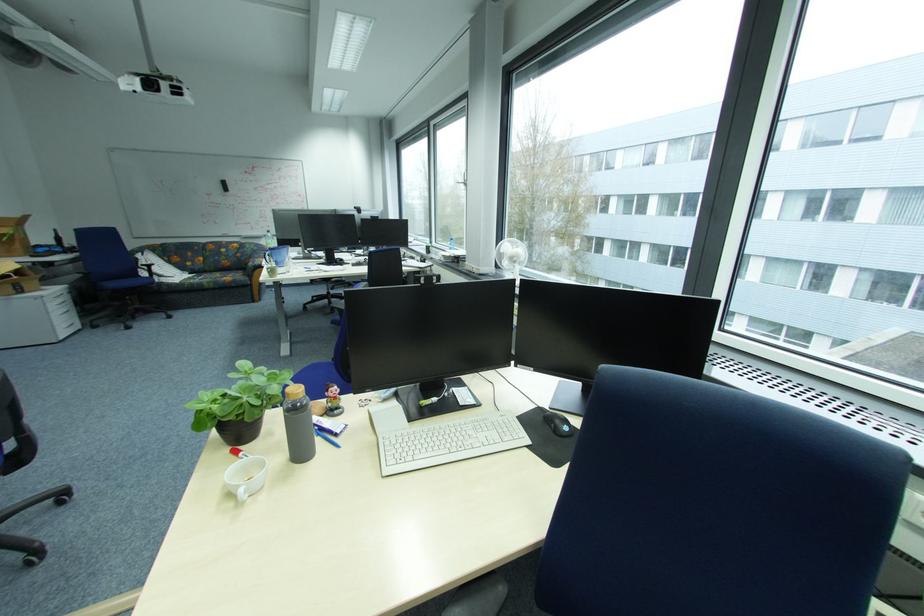
The location [511,254] corresponds to which object?

It refers to a white portable fan.